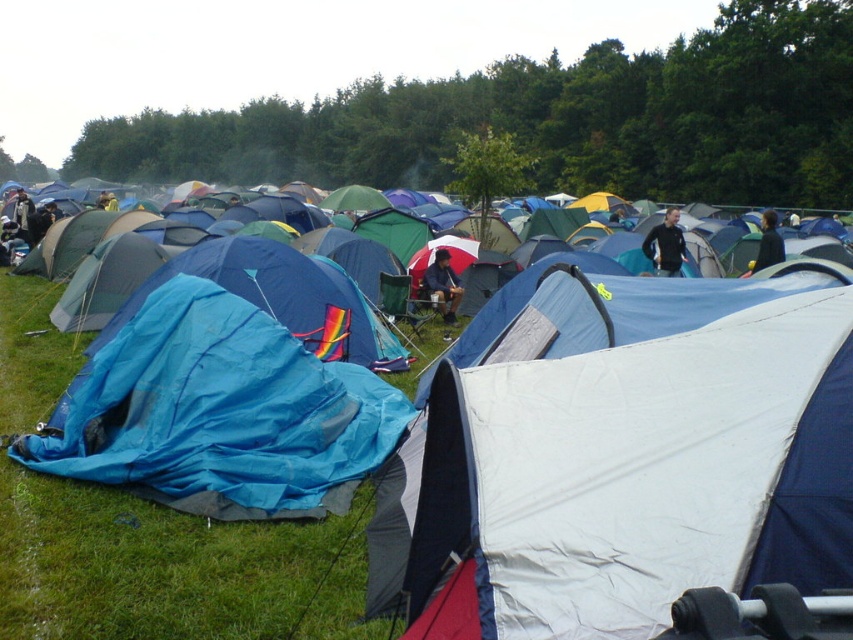
Is matte blue tent at center closer to camera compared to dark blue fabric jacket at upper right?

That is False.

Based on the photo, is matte blue tent at center bigger than dark blue fabric jacket at upper right?

No, matte blue tent at center is not bigger than dark blue fabric jacket at upper right.

Identify the location of matte blue tent at center. (442, 285).

Who is positioned more to the left, blue fabric tent at lower left or matte blue tent at center?

From the viewer's perspective, blue fabric tent at lower left appears more on the left side.

Based on the photo, does blue fabric tent at lower left have a lesser height compared to matte blue tent at center?

In fact, blue fabric tent at lower left may be taller than matte blue tent at center.

Is point (1, 608) less distant than point (432, 291)?

Yes, it is.

This screenshot has height=640, width=853. Find the location of `blue fabric tent at lower left`. blue fabric tent at lower left is located at coordinates (148, 564).

Can you confirm if blue tarp at center is wider than matte blue tent at center?

Indeed, blue tarp at center has a greater width compared to matte blue tent at center.

Which is above, blue tarp at center or matte blue tent at center?

Positioned higher is blue tarp at center.

Does point (28, 340) lie behind point (456, 301)?

No, it is in front of (456, 301).

Image resolution: width=853 pixels, height=640 pixels. In order to click on blue tarp at center in this screenshot , I will do `click(171, 568)`.